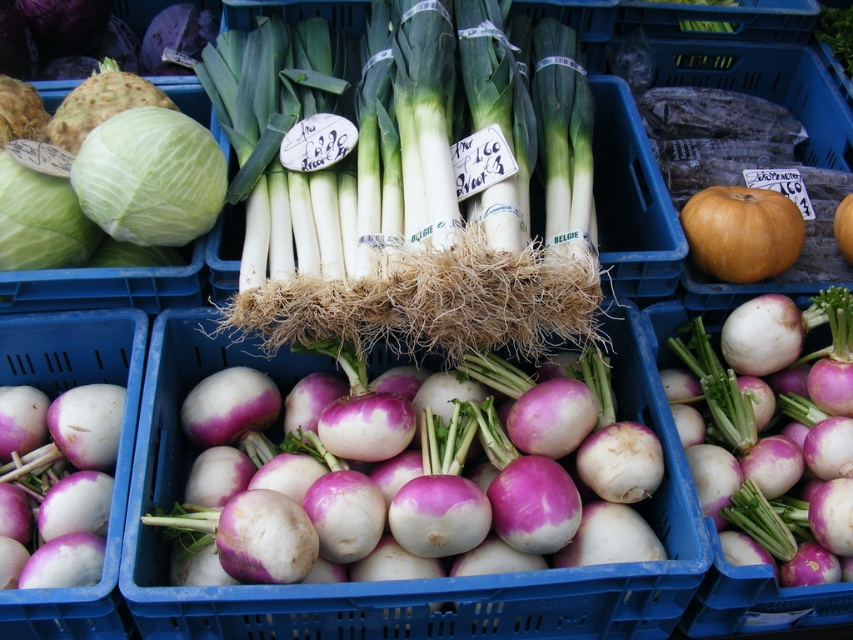
You are a delivery person who needs to pick up a matte orange pumpkin at center and a green matte cabbage at upper left from the market stall. The delivery truck can only make a single trip, and you can carry items up to 5 feet apart. Can you carry both items at the same time?

The matte orange pumpkin at center and green matte cabbage at upper left are 4.27 feet apart from each other. Since the distance between them is less than 5 feet, you can carry both items at the same time.

You are a customer at the market stall and want to find the purple matte turnip at center. Based on the coordinates provided, where should you look relative to the edge of the crate?

The purple matte turnip at center is located at point 0.692 along the horizontal axis and 0.912 along the vertical axis from the bottom left corner of the crate. This means it is positioned approximately two thirds of the way to the right and very near the top of the crate.